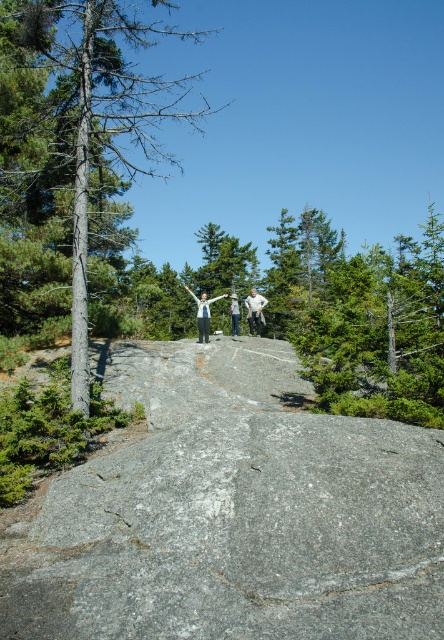
You are a hiker who wants to place a small backpack on the gray rough rock at center. The backpack requires a surface taller than the white fabric at center to avoid being hidden. Can you place the backpack there?

The gray rough rock at center is shorter than the white fabric at center. Since the backpack needs a surface taller than the white fabric at center to avoid being hidden, placing it on the gray rough rock at center would not work because the rock is shorter than the fabric.

You are planning to set up a small campsite on the gray rough rock at center. Considering the height of the green textured tree at center, will the tree block sunlight reaching the rock during the day?

The gray rough rock at center is not as tall as the green textured tree at center, so the tree might block sunlight from reaching the rock depending on the time of day and the tree canopy density.